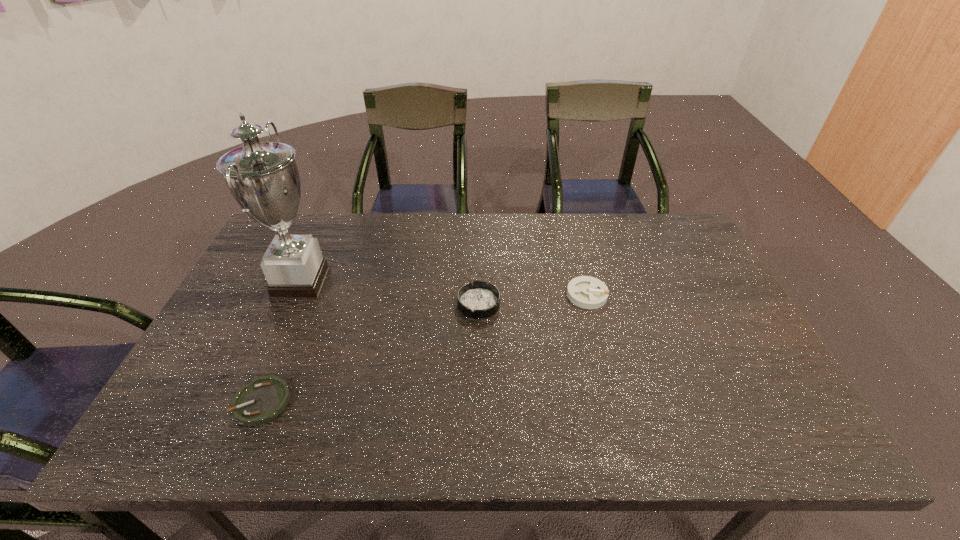
This screenshot has width=960, height=540. I want to click on object that stands as the closest to the trophy cup, so click(262, 400).

I want to click on ashtray that stands as the closest to the rightmost object, so click(x=480, y=299).

Select which ashtray is the second closest to the third object from left to right. Please provide its 2D coordinates. Your answer should be formatted as a tuple, i.e. [(x, y)], where the tuple contains the x and y coordinates of a point satisfying the conditions above.

[(262, 400)]

Find the location of a particular element. The width and height of the screenshot is (960, 540). free space that satisfies the following two spatial constraints: 1. at the front view of the nearest ashtray; 2. on the right side of the tallest object is located at coordinates (247, 402).

Find the location of a particular element. blank area in the image that satisfies the following two spatial constraints: 1. on the back side of the shortest ashtray; 2. on the left side of the second ashtray from right to left is located at coordinates (303, 303).

Where is `free space that satisfies the following two spatial constraints: 1. at the front view of the trophy cup; 2. on the left side of the shortest object`? The height and width of the screenshot is (540, 960). free space that satisfies the following two spatial constraints: 1. at the front view of the trophy cup; 2. on the left side of the shortest object is located at coordinates (247, 402).

Find the location of a particular element. vacant position in the image that satisfies the following two spatial constraints: 1. at the front view of the second object from right to left; 2. on the left side of the tallest object is located at coordinates (291, 303).

Image resolution: width=960 pixels, height=540 pixels. I want to click on vacant space that satisfies the following two spatial constraints: 1. on the back side of the rightmost object; 2. on the right side of the second object from right to left, so click(479, 295).

The image size is (960, 540). In order to click on free space in the image that satisfies the following two spatial constraints: 1. on the back side of the leftmost ashtray; 2. on the left side of the second ashtray from right to left in this screenshot , I will do `click(303, 303)`.

The height and width of the screenshot is (540, 960). In order to click on vacant area that satisfies the following two spatial constraints: 1. on the back side of the shortest object; 2. on the left side of the second ashtray from left to right in this screenshot , I will do `click(303, 303)`.